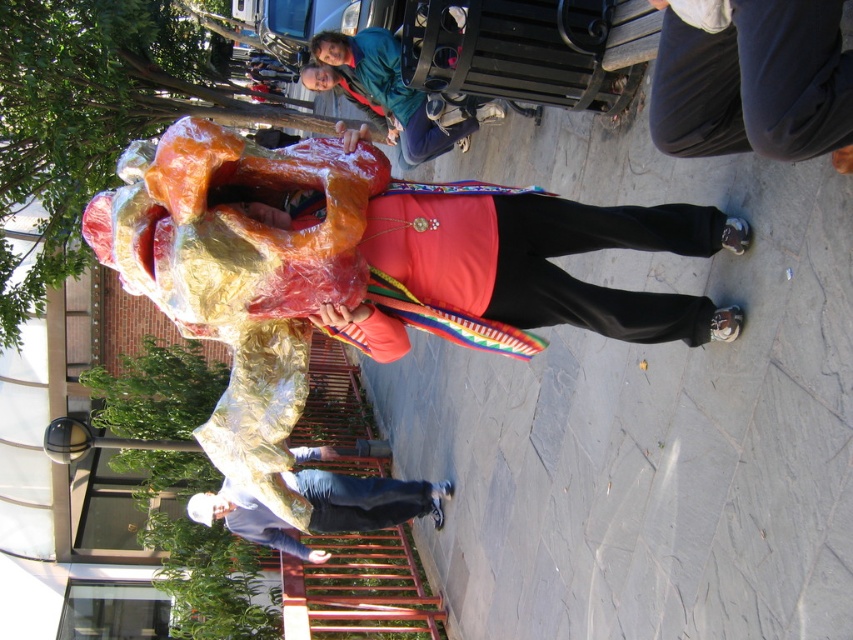
Question: Does shiny metallic costume at center appear under shiny gold costume at center?

Choices:
 (A) no
 (B) yes

Answer: (B)

Question: Which object is farther from the camera taking this photo?

Choices:
 (A) shiny gold costume at center
 (B) shiny metallic costume at center

Answer: (A)

Question: Does shiny metallic costume at center have a greater width compared to shiny gold costume at center?

Choices:
 (A) yes
 (B) no

Answer: (B)

Question: Which object is closer to the camera taking this photo?

Choices:
 (A) shiny gold costume at center
 (B) shiny metallic costume at center

Answer: (B)

Question: Is shiny metallic costume at center to the right of shiny gold costume at center from the viewer's perspective?

Choices:
 (A) yes
 (B) no

Answer: (A)

Question: Which point is farther to the camera?

Choices:
 (A) shiny metallic costume at center
 (B) shiny gold costume at center

Answer: (B)